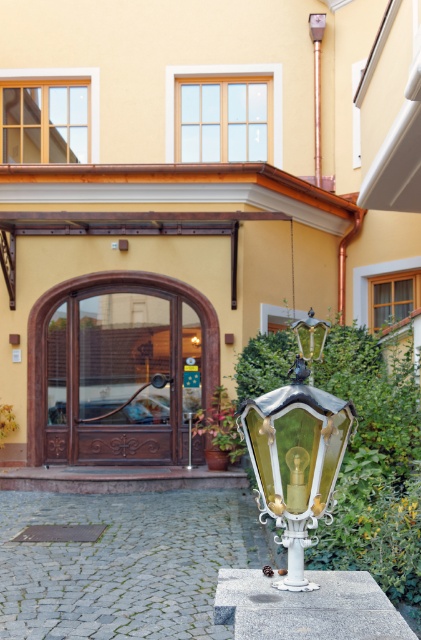
You are a pedestrian standing in front of the building and want to take a photo of the green glass lamp post at center without the metallic copper pole at upper center blocking the view. Is it possible to do so?

The green glass lamp post at center is positioned under the metallic copper pole at upper center, so if you stand directly below the pole, the pole will block the view. However, if you move to the side, you can position yourself so that the pole is out of the frame, allowing you to capture the lamp post without obstruction.

You are standing in front of the traditional building and notice the green glass lamp post at center and the metallic copper pole at upper center. Which object is shorter?

The green glass lamp post at center is shorter than the metallic copper pole at upper center.

You are standing in front of the traditional building and notice two points marked on the facade. The first point is at coordinates point (272, 492), and the second is at point (317, 24). Which of these points is closer to you?

Point (272, 492) is closer to the viewer than point (317, 24).